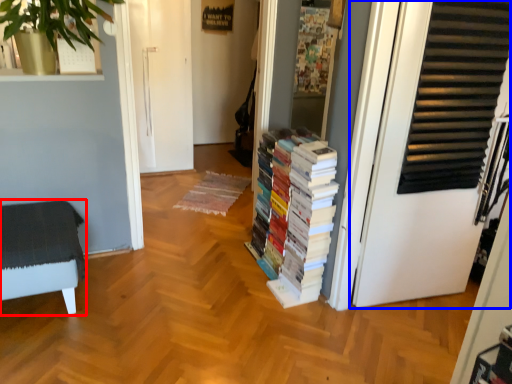
Question: Which of the following is the closest to the observer, furniture (highlighted by a red box) or door (highlighted by a blue box)?

Choices:
 (A) furniture
 (B) door

Answer: (B)